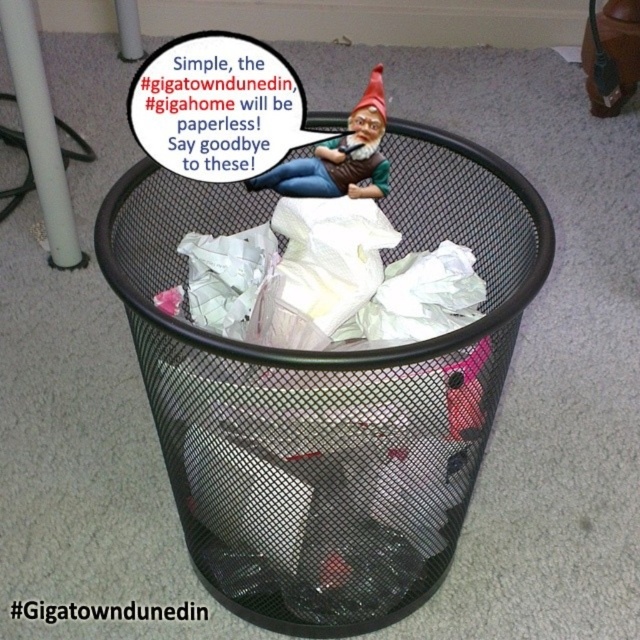
Question: Is matte plastic gnome at upper center to the left of red felt gnome hat at upper center from the viewer's perspective?

Choices:
 (A) yes
 (B) no

Answer: (A)

Question: Which point is closer to the camera taking this photo?

Choices:
 (A) (282, 180)
 (B) (371, 102)

Answer: (B)

Question: Considering the relative positions of matte plastic gnome at upper center and red felt gnome hat at upper center in the image provided, where is matte plastic gnome at upper center located with respect to red felt gnome hat at upper center?

Choices:
 (A) left
 (B) right

Answer: (A)

Question: Considering the relative positions of matte plastic gnome at upper center and red felt gnome hat at upper center in the image provided, where is matte plastic gnome at upper center located with respect to red felt gnome hat at upper center?

Choices:
 (A) above
 (B) below

Answer: (B)